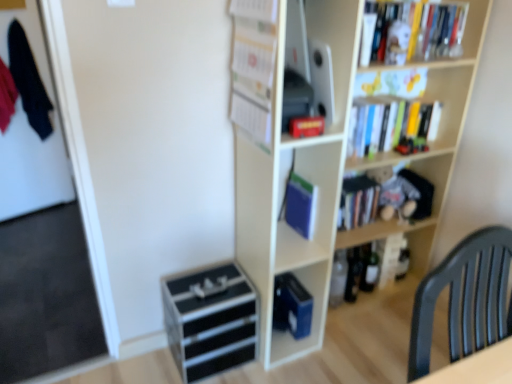
Identify the location of free space above black plastic drawer at lower center (from a real-world perspective). Image resolution: width=512 pixels, height=384 pixels. (206, 279).